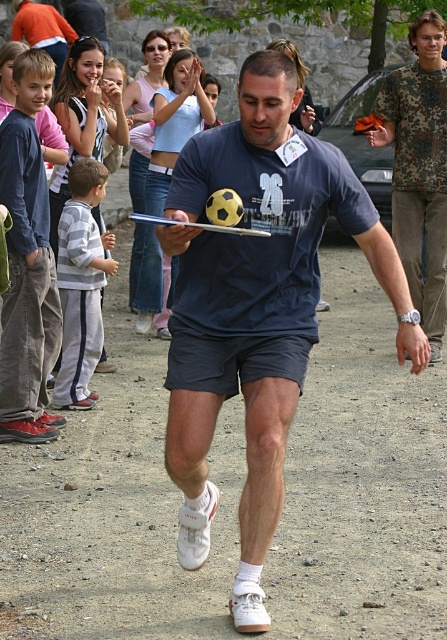
Question: Which point is farther from the camera taking this photo?

Choices:
 (A) (446, 182)
 (B) (100, 179)
 (C) (34, 104)

Answer: (A)

Question: Considering the relative positions of gray/white track suit at left and light blue denim shorts at center in the image provided, where is gray/white track suit at left located with respect to light blue denim shorts at center?

Choices:
 (A) right
 (B) left

Answer: (B)

Question: Considering the relative positions of gray/white track suit at left and light blue denim shorts at center in the image provided, where is gray/white track suit at left located with respect to light blue denim shorts at center?

Choices:
 (A) below
 (B) above

Answer: (A)

Question: Which object is farther from the camera taking this photo?

Choices:
 (A) gray/white track suit at left
 (B) light blue denim shorts at center
 (C) camouflage fabric shirt at right
 (D) matte blue shirt at left

Answer: (B)

Question: Can you confirm if matte blue t-shirt at center is positioned to the right of camouflage fabric shirt at right?

Choices:
 (A) yes
 (B) no

Answer: (B)

Question: Which point is closer to the camera?

Choices:
 (A) (24, 177)
 (B) (298, 355)
 (C) (88, 404)

Answer: (B)